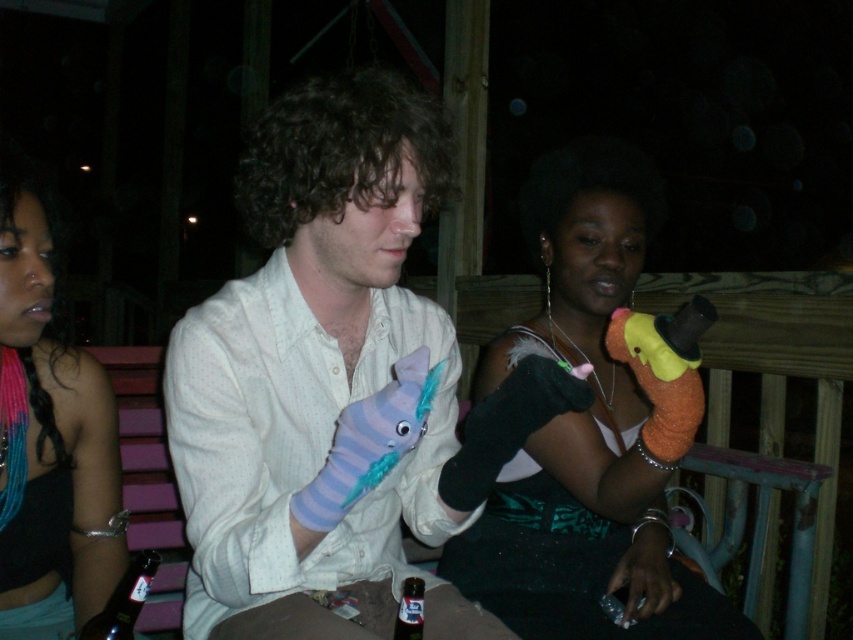
Question: Does orange fuzzy glove at center appear over translucent glass bottle at lower left?

Choices:
 (A) no
 (B) yes

Answer: (B)

Question: Which point is closer to the camera?

Choices:
 (A) black fabric top at left
 (B) translucent glass bottle at lower left
 (C) translucent plastic bottle at lower center
 (D) orange fuzzy glove at center

Answer: (B)

Question: Which point appears farthest from the camera in this image?

Choices:
 (A) (401, 621)
 (B) (618, 582)

Answer: (B)

Question: Which of the following is the farthest from the observer?

Choices:
 (A) orange fuzzy glove at center
 (B) black fabric top at left
 (C) white cotton shirt at center

Answer: (B)

Question: Does white cotton shirt at center have a greater width compared to translucent glass bottle at lower left?

Choices:
 (A) yes
 (B) no

Answer: (A)

Question: Is white cotton shirt at center positioned behind translucent plastic bottle at lower center?

Choices:
 (A) no
 (B) yes

Answer: (A)